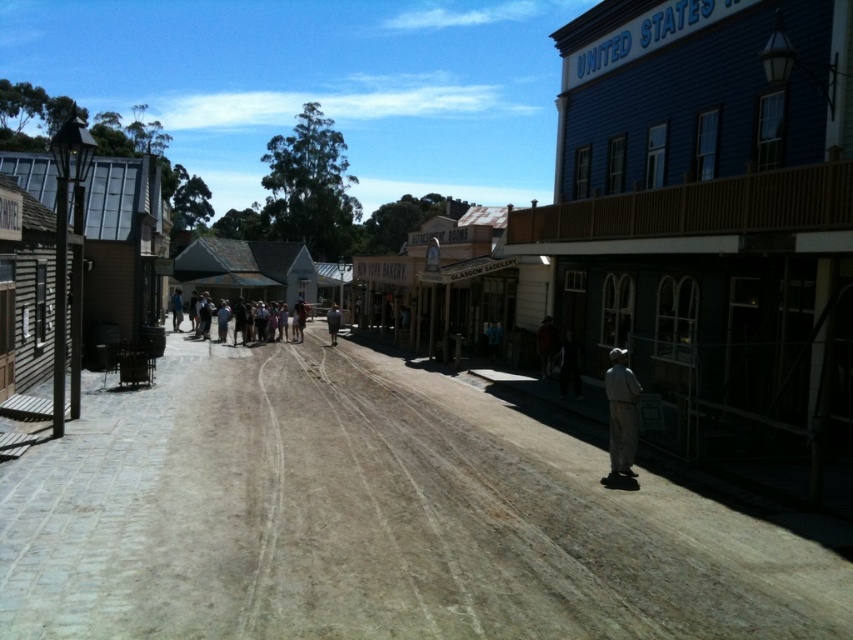
You are a traveler in this 19th century town and you see two items on the ground. The gray fabric pants at lower right and the dark gray fabric jacket at center. Which item is smaller in size?

The gray fabric pants at lower right has a smaller size compared to the dark gray fabric jacket at center, so the gray fabric pants at lower right is smaller.

You are a traveler on a horse approaching the town. You see the brown dusty dirt track at center and the gray fabric pants at lower right. Which object is closer to you as you approach the town?

The brown dusty dirt track at center is closer to the viewer than the gray fabric pants at lower right, so the dirt track is closer to you as you approach the town.